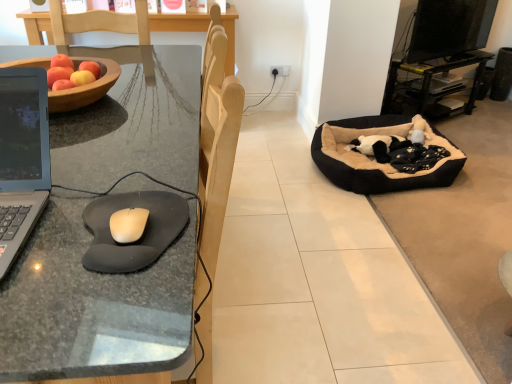
Identify the location of vacant region in front of black foam mousepad at left. coord(99,309).